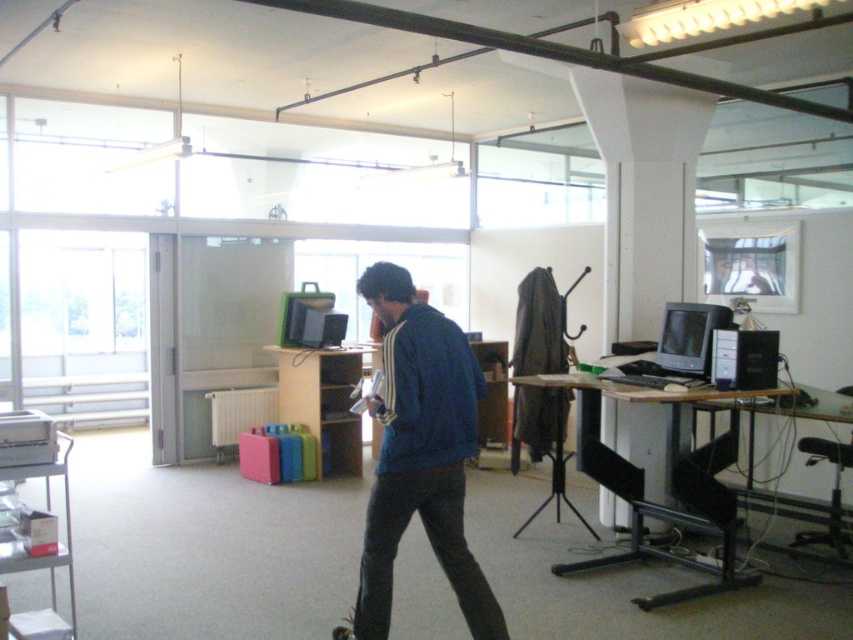
Question: Which object appears closest to the camera in this image?

Choices:
 (A) blue fabric jacket at center
 (B) metallic silver skateboard at lower center

Answer: (A)

Question: Which point is closer to the camera taking this photo?

Choices:
 (A) (381, 300)
 (B) (347, 634)

Answer: (A)

Question: Can you confirm if blue fabric jacket at center is thinner than metallic silver skateboard at lower center?

Choices:
 (A) yes
 (B) no

Answer: (B)

Question: Observing the image, what is the correct spatial positioning of blue fabric jacket at center in reference to metallic silver skateboard at lower center?

Choices:
 (A) above
 (B) below

Answer: (A)

Question: Which object is farther from the camera taking this photo?

Choices:
 (A) blue fabric jacket at center
 (B) metallic silver skateboard at lower center

Answer: (B)

Question: Is blue fabric jacket at center closer to the viewer compared to metallic silver skateboard at lower center?

Choices:
 (A) yes
 (B) no

Answer: (A)